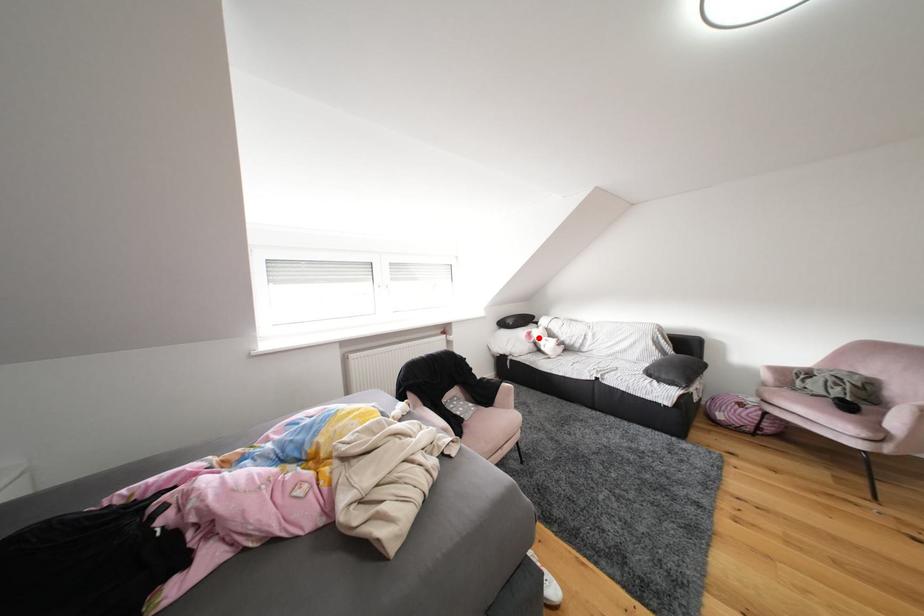
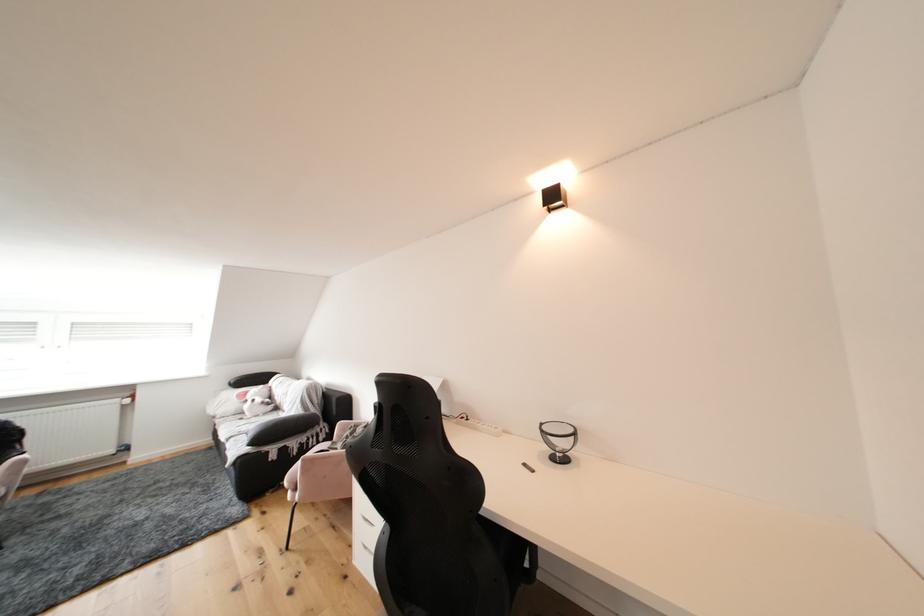
The point at the highlighted location is marked in the first image. Where is the corresponding point in the second image?

(256, 397)